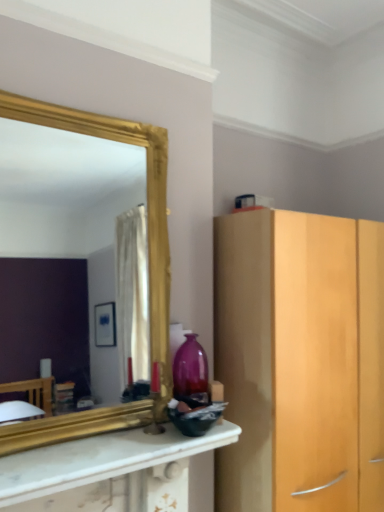
You are a GUI agent. You are given a task and a screenshot of the screen. Output one action in this format:
    pyautogui.click(x=<x>, y=<y>)
    Task: Click on the free point above white marble countertop at center (from a real-world perspective)
    This screenshot has height=512, width=384.
    Given the screenshot: What is the action you would take?
    pyautogui.click(x=97, y=448)